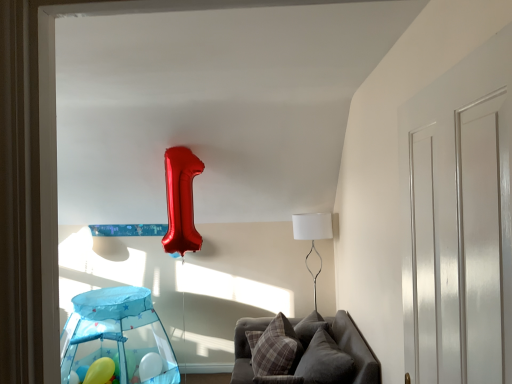
Question: Is point (105, 322) positioned closer to the camera than point (482, 359)?

Choices:
 (A) closer
 (B) farther

Answer: (B)

Question: Is transparent plastic play tent at lower left inside or outside of white glossy door at right?

Choices:
 (A) outside
 (B) inside

Answer: (A)

Question: Which is nearer to the white glossy door at right?

Choices:
 (A) velvet gray couch at lower center
 (B) matte yellow balloon at lower left
 (C) white fabric lampshade at right
 (D) plush gray pillow at lower center, which appears as the 2th pillow when viewed from the left
 (E) plaid fabric pillow at lower center, which is the 2th pillow from right to left

Answer: (A)

Question: Which is nearer to the white fabric lampshade at right?

Choices:
 (A) velvet gray couch at lower center
 (B) plaid fabric pillow at lower center, positioned as the 1th pillow in left-to-right order
 (C) white glossy door at right
 (D) matte yellow balloon at lower left
 (E) transparent plastic play tent at lower left

Answer: (A)